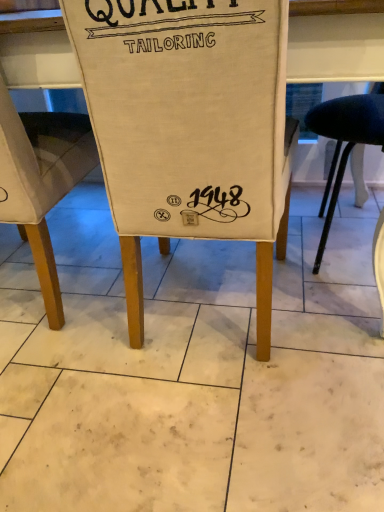
Question: From the image's perspective, is canvas bag at center, positioned as the 1th chair in right-to-left order, above canvas chair at lower left, the 2th chair viewed from the right?

Choices:
 (A) no
 (B) yes

Answer: (A)

Question: Is canvas bag at center, which appears as the second chair when viewed from the left, facing away from canvas chair at lower left, the 2th chair viewed from the right?

Choices:
 (A) yes
 (B) no

Answer: (B)

Question: From the image's perspective, is canvas bag at center, positioned as the 1th chair in right-to-left order, located beneath canvas chair at lower left, acting as the 1th chair starting from the left?

Choices:
 (A) yes
 (B) no

Answer: (A)

Question: Does canvas bag at center, which appears as the second chair when viewed from the left, have a greater height compared to canvas chair at lower left, acting as the 1th chair starting from the left?

Choices:
 (A) yes
 (B) no

Answer: (A)

Question: Is canvas bag at center, which appears as the second chair when viewed from the left, wider than canvas chair at lower left, the 2th chair viewed from the right?

Choices:
 (A) yes
 (B) no

Answer: (A)

Question: Is the depth of canvas bag at center, positioned as the 1th chair in right-to-left order, less than that of canvas chair at lower left, acting as the 1th chair starting from the left?

Choices:
 (A) no
 (B) yes

Answer: (B)

Question: Is canvas chair at lower left, acting as the 1th chair starting from the left, positioned behind canvas bag at center, which appears as the second chair when viewed from the left?

Choices:
 (A) no
 (B) yes

Answer: (B)

Question: Is canvas chair at lower left, the 2th chair viewed from the right, shorter than canvas bag at center, positioned as the 1th chair in right-to-left order?

Choices:
 (A) no
 (B) yes

Answer: (B)

Question: Does canvas chair at lower left, acting as the 1th chair starting from the left, have a smaller size compared to canvas bag at center, which appears as the second chair when viewed from the left?

Choices:
 (A) no
 (B) yes

Answer: (B)

Question: Is canvas bag at center, which appears as the second chair when viewed from the left, completely or partially inside canvas chair at lower left, acting as the 1th chair starting from the left?

Choices:
 (A) yes
 (B) no

Answer: (B)

Question: Can you confirm if canvas chair at lower left, the 2th chair viewed from the right, is thinner than canvas bag at center, positioned as the 1th chair in right-to-left order?

Choices:
 (A) no
 (B) yes

Answer: (B)

Question: Is canvas chair at lower left, acting as the 1th chair starting from the left, completely or partially outside of canvas bag at center, which appears as the second chair when viewed from the left?

Choices:
 (A) yes
 (B) no

Answer: (A)

Question: From their relative heights in the image, would you say canvas chair at lower left, the 2th chair viewed from the right, is taller or shorter than canvas bag at center, positioned as the 1th chair in right-to-left order?

Choices:
 (A) tall
 (B) short

Answer: (B)